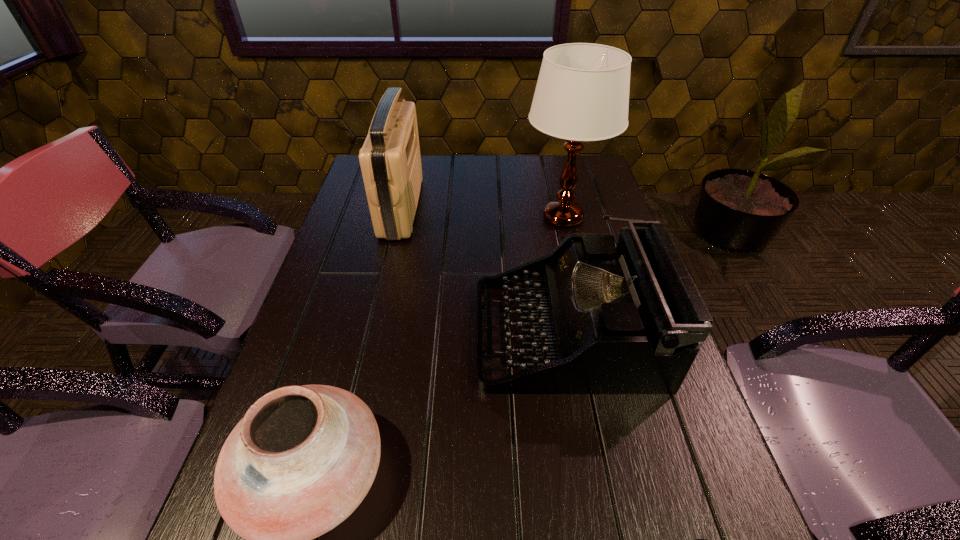
What are the coordinates of `table lamp` in the screenshot? It's located at (582, 94).

Locate an element on the screen. The image size is (960, 540). the second tallest object is located at coordinates (390, 160).

I want to click on typewriter, so click(x=628, y=319).

I want to click on blank area located on the left of the tallest object, so click(x=477, y=217).

Locate an element on the screen. The image size is (960, 540). free space located 0.360m on the front-facing side of the second tallest object is located at coordinates (538, 207).

I want to click on vacant area situated 0.270m on the typing side of the third nearest object, so tap(356, 332).

The height and width of the screenshot is (540, 960). What are the coordinates of `blank area located 0.050m on the typing side of the third nearest object` in the screenshot? It's located at (455, 332).

Locate an element on the screen. The height and width of the screenshot is (540, 960). vacant space situated 0.370m on the typing side of the third nearest object is located at coordinates (312, 332).

Locate an element on the screen. object located in the far edge section of the desktop is located at coordinates (390, 160).

Locate an element on the screen. object located at the left edge is located at coordinates pyautogui.click(x=390, y=160).